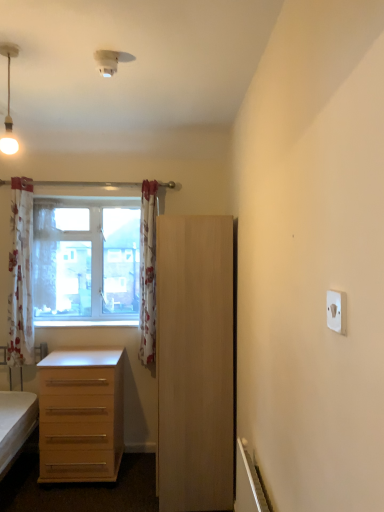
Question: Can you confirm if light wood cabinet at center is positioned to the right of light wood drawer at lower left?

Choices:
 (A) yes
 (B) no

Answer: (A)

Question: Would you say light wood cabinet at center contains light wood drawer at lower left?

Choices:
 (A) no
 (B) yes

Answer: (A)

Question: Is light wood cabinet at center in contact with light wood drawer at lower left?

Choices:
 (A) no
 (B) yes

Answer: (A)

Question: From a real-world perspective, is light wood cabinet at center positioned over light wood drawer at lower left based on gravity?

Choices:
 (A) yes
 (B) no

Answer: (A)

Question: Does light wood cabinet at center come behind light wood drawer at lower left?

Choices:
 (A) no
 (B) yes

Answer: (A)

Question: Are light wood cabinet at center and light wood drawer at lower left far apart?

Choices:
 (A) no
 (B) yes

Answer: (A)

Question: Does clear glass window at upper left touch white floral fabric curtain at left, which appears as the third curtain when viewed from the right?

Choices:
 (A) no
 (B) yes

Answer: (A)

Question: Is clear glass window at upper left closer to the viewer compared to white floral fabric curtain at left, which is counted as the first curtain, starting from the left?

Choices:
 (A) yes
 (B) no

Answer: (B)

Question: Would you say clear glass window at upper left is a long distance from white floral fabric curtain at left, which appears as the third curtain when viewed from the right?

Choices:
 (A) no
 (B) yes

Answer: (A)

Question: Considering the relative sizes of clear glass window at upper left and white floral fabric curtain at left, which is counted as the first curtain, starting from the left, in the image provided, is clear glass window at upper left shorter than white floral fabric curtain at left, which is counted as the first curtain, starting from the left,?

Choices:
 (A) yes
 (B) no

Answer: (A)

Question: Can you confirm if clear glass window at upper left is wider than white floral fabric curtain at left, which is counted as the first curtain, starting from the left?

Choices:
 (A) no
 (B) yes

Answer: (A)

Question: Is clear glass window at upper left outside of white floral fabric curtain at left, which appears as the third curtain when viewed from the right?

Choices:
 (A) no
 (B) yes

Answer: (B)

Question: Could you tell me if white floral curtain at window, the second curtain when ordered from right to left, is turned towards floral fabric curtain at center, which ranks as the 3th curtain in left-to-right order?

Choices:
 (A) no
 (B) yes

Answer: (A)